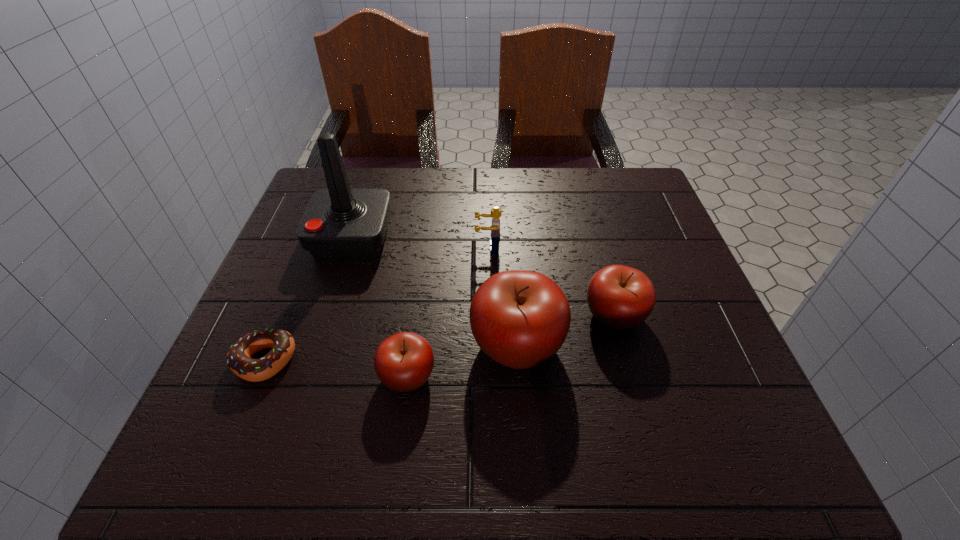
Find the location of a particular element. The width and height of the screenshot is (960, 540). object that is the fifth nearest to the second shortest object is located at coordinates (620, 297).

Where is `apple that is the second closest one to the joystick`? The height and width of the screenshot is (540, 960). apple that is the second closest one to the joystick is located at coordinates (403, 362).

Point out which apple is positioned as the second nearest to the Lego. Please provide its 2D coordinates. Your answer should be formatted as a tuple, i.e. [(x, y)], where the tuple contains the x and y coordinates of a point satisfying the conditions above.

[(620, 297)]

Where is `vacant point that satisfies the following two spatial constraints: 1. on the front side of the tallest object; 2. on the right side of the fifth shortest object`? vacant point that satisfies the following two spatial constraints: 1. on the front side of the tallest object; 2. on the right side of the fifth shortest object is located at coordinates (318, 344).

In order to click on vacant area that satisfies the following two spatial constraints: 1. on the face of the second apple from left to right; 2. on the right side of the Lego in this screenshot , I will do `click(490, 344)`.

Identify the location of vacant point that satisfies the following two spatial constraints: 1. on the face of the Lego; 2. on the right side of the second tallest object. This screenshot has height=540, width=960. (490, 344).

Where is `vacant space that satisfies the following two spatial constraints: 1. on the back side of the rightmost apple; 2. on the left side of the fifth tallest object`? This screenshot has height=540, width=960. vacant space that satisfies the following two spatial constraints: 1. on the back side of the rightmost apple; 2. on the left side of the fifth tallest object is located at coordinates (416, 315).